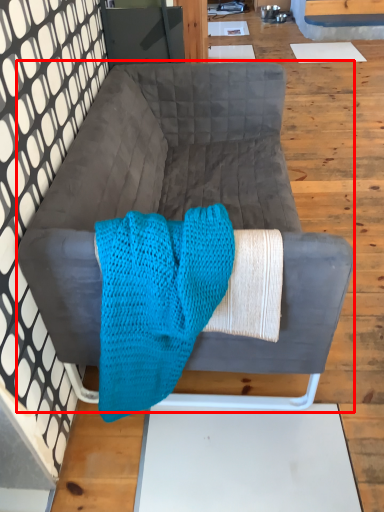
Question: From the image's perspective, considering the relative positions of studio couch (annotated by the red box) and blanket in the image provided, where is studio couch (annotated by the red box) located with respect to the staircase?

Choices:
 (A) above
 (B) below

Answer: (A)